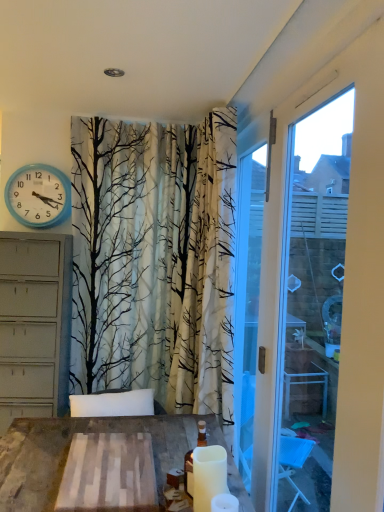
Question: Which direction should I rotate to face white matte candle at lower center, the 1th candle when ordered from back to front, — up or down?

Choices:
 (A) down
 (B) up

Answer: (A)

Question: Would you consider white matte candle at lower right, which ranks as the 2th candle in back-to-front order, to be distant from blue plastic wall clock at upper left?

Choices:
 (A) no
 (B) yes

Answer: (B)

Question: Are white matte candle at lower right, which is counted as the 1th candle, starting from the front, and blue plastic wall clock at upper left making contact?

Choices:
 (A) no
 (B) yes

Answer: (A)

Question: Considering the relative positions of white matte candle at lower right, which ranks as the 2th candle in back-to-front order, and blue plastic wall clock at upper left in the image provided, is white matte candle at lower right, which ranks as the 2th candle in back-to-front order, to the left of blue plastic wall clock at upper left from the viewer's perspective?

Choices:
 (A) yes
 (B) no

Answer: (B)

Question: From the image's perspective, does white matte candle at lower right, which ranks as the 2th candle in back-to-front order, appear lower than blue plastic wall clock at upper left?

Choices:
 (A) no
 (B) yes

Answer: (B)

Question: Is the depth of white matte candle at lower right, which is counted as the 1th candle, starting from the front, greater than that of blue plastic wall clock at upper left?

Choices:
 (A) yes
 (B) no

Answer: (B)

Question: Can you confirm if white matte candle at lower right, which is counted as the 1th candle, starting from the front, is taller than blue plastic wall clock at upper left?

Choices:
 (A) yes
 (B) no

Answer: (B)

Question: Does white matte candle at lower right, which is counted as the 1th candle, starting from the front, lie in front of white plastic window frame at right?

Choices:
 (A) no
 (B) yes

Answer: (A)

Question: Is white matte candle at lower right, which ranks as the 2th candle in back-to-front order, completely or partially outside of white plastic window frame at right?

Choices:
 (A) yes
 (B) no

Answer: (A)

Question: Does white matte candle at lower right, which is counted as the 1th candle, starting from the front, have a lesser height compared to white plastic window frame at right?

Choices:
 (A) no
 (B) yes

Answer: (B)

Question: From the image's perspective, would you say white matte candle at lower right, which is counted as the 1th candle, starting from the front, is positioned over white plastic window frame at right?

Choices:
 (A) yes
 (B) no

Answer: (B)

Question: Are white matte candle at lower right, which is counted as the 1th candle, starting from the front, and white plastic window frame at right making contact?

Choices:
 (A) yes
 (B) no

Answer: (B)

Question: Does white matte candle at lower right, which ranks as the 2th candle in back-to-front order, have a larger size compared to white plastic window frame at right?

Choices:
 (A) no
 (B) yes

Answer: (A)

Question: Does blue plastic wall clock at upper left have a smaller size compared to white matte candle at lower center, the 1th candle when ordered from back to front?

Choices:
 (A) yes
 (B) no

Answer: (B)